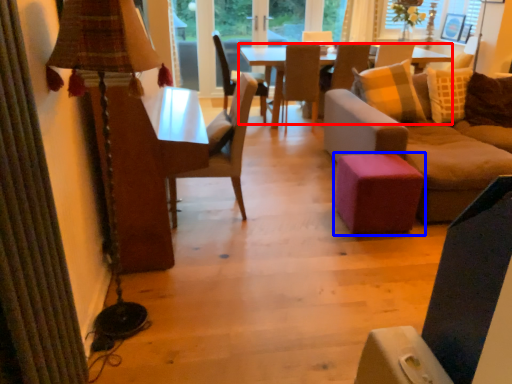
Question: Which object appears closest to the camera in this image, table (highlighted by a red box) or stool (highlighted by a blue box)?

Choices:
 (A) table
 (B) stool

Answer: (B)